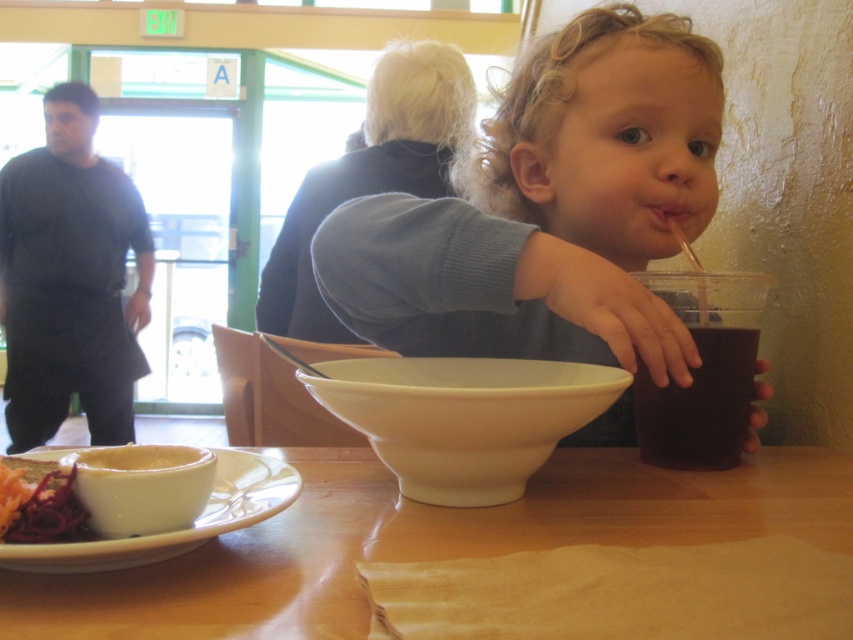
Question: Is black matte shirt at left positioned before white ceramic bowl at center?

Choices:
 (A) no
 (B) yes

Answer: (A)

Question: Among these objects, which one is nearest to the camera?

Choices:
 (A) smooth plastic cup at center
 (B) black matte shirt at left
 (C) white matte bowl at lower left
 (D) white ceramic plate at lower left

Answer: (D)

Question: Is smooth plastic cup at center in front of black matte shirt at left?

Choices:
 (A) no
 (B) yes

Answer: (B)

Question: Which object is the closest to the white ceramic plate at lower left?

Choices:
 (A) white matte bowl at lower left
 (B) white ceramic bowl at center
 (C) shiny red beets at lower left
 (D) smooth plastic cup at center

Answer: (A)

Question: Is white ceramic plate at lower left positioned behind white matte bowl at lower left?

Choices:
 (A) no
 (B) yes

Answer: (A)

Question: Which object appears closest to the camera in this image?

Choices:
 (A) shiny red beets at lower left
 (B) white ceramic bowl at center
 (C) white matte bowl at lower left
 (D) dark matte cup at right

Answer: (A)